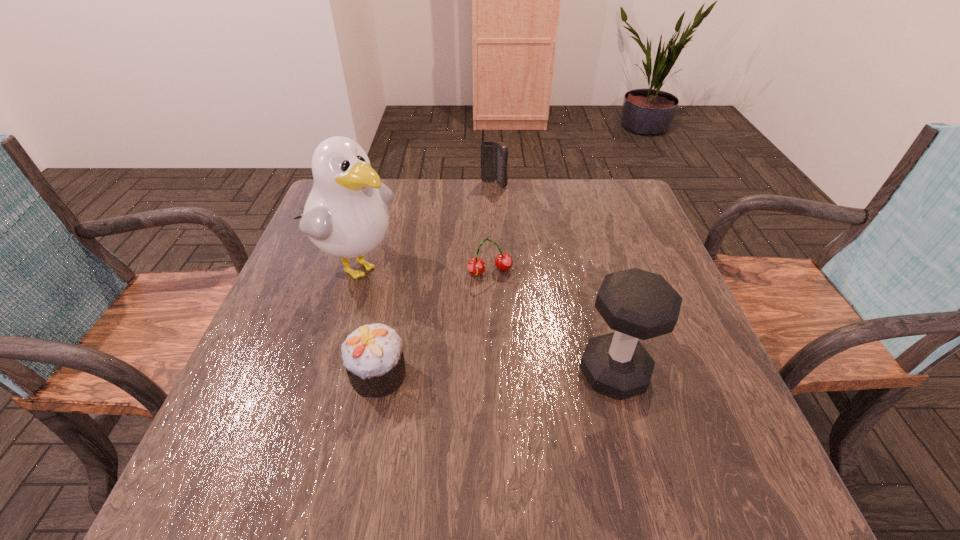
The height and width of the screenshot is (540, 960). In order to click on free space on the desktop that is between the cupcake and the rightmost object and is positioned on the beak of the gull in this screenshot , I will do `click(511, 374)`.

Find the location of `vacant spot on the desktop that is between the cupcake and the dumbbell and is positioned on the keyboard of the cellular telephone`. vacant spot on the desktop that is between the cupcake and the dumbbell and is positioned on the keyboard of the cellular telephone is located at coordinates (489, 374).

At what (x,y) coordinates should I click in order to perform the action: click on vacant spot on the desktop that is between the cupcake and the dumbbell and is positioned with stems pointing upwards on the cherry. Please return your answer as a coordinate pair (x, y). Image resolution: width=960 pixels, height=540 pixels. Looking at the image, I should click on (527, 374).